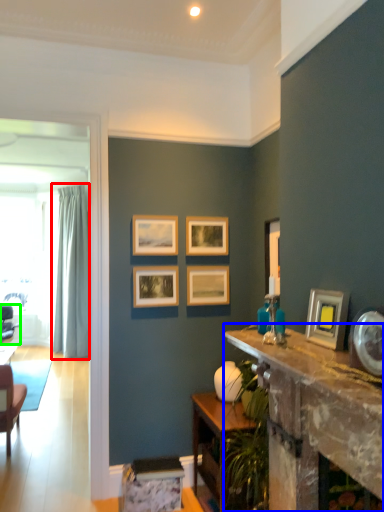
Question: Which is farther away from curtain (highlighted by a red box)? table (highlighted by a blue box) or chair (highlighted by a green box)?

Choices:
 (A) table
 (B) chair

Answer: (A)